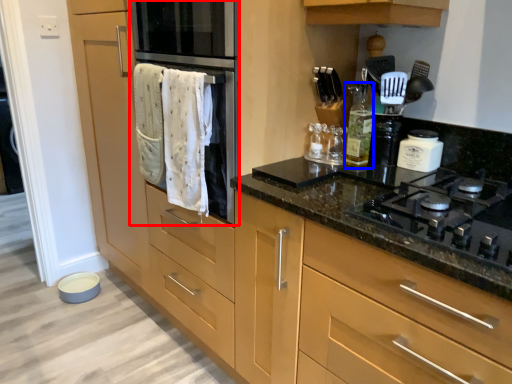
Question: Which object is closer to the camera taking this photo, oven (highlighted by a red box) or bottle (highlighted by a blue box)?

Choices:
 (A) oven
 (B) bottle

Answer: (A)